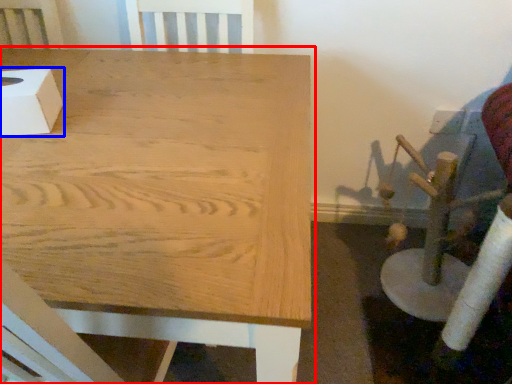
Question: Which object is closer to the camera taking this photo, table (highlighted by a red box) or box (highlighted by a blue box)?

Choices:
 (A) table
 (B) box

Answer: (A)